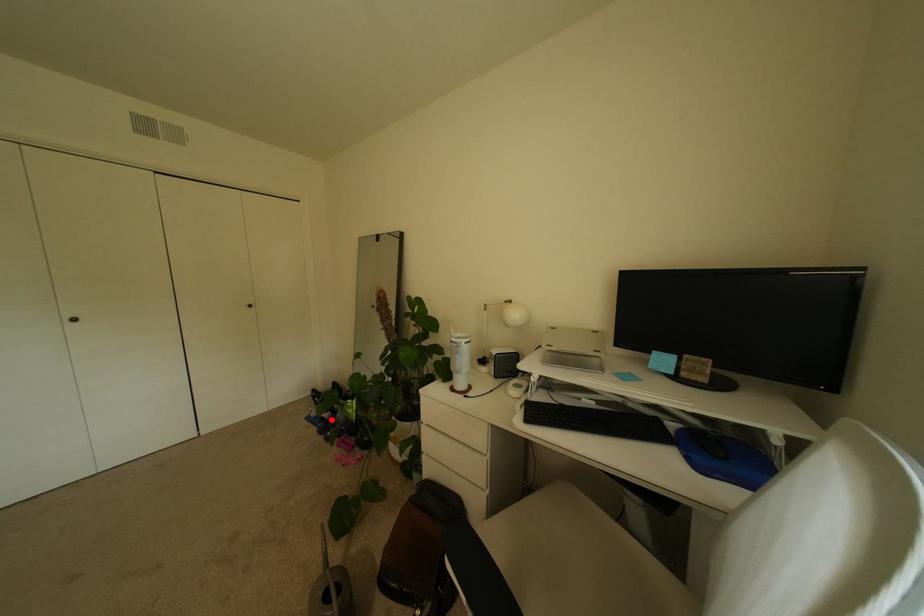
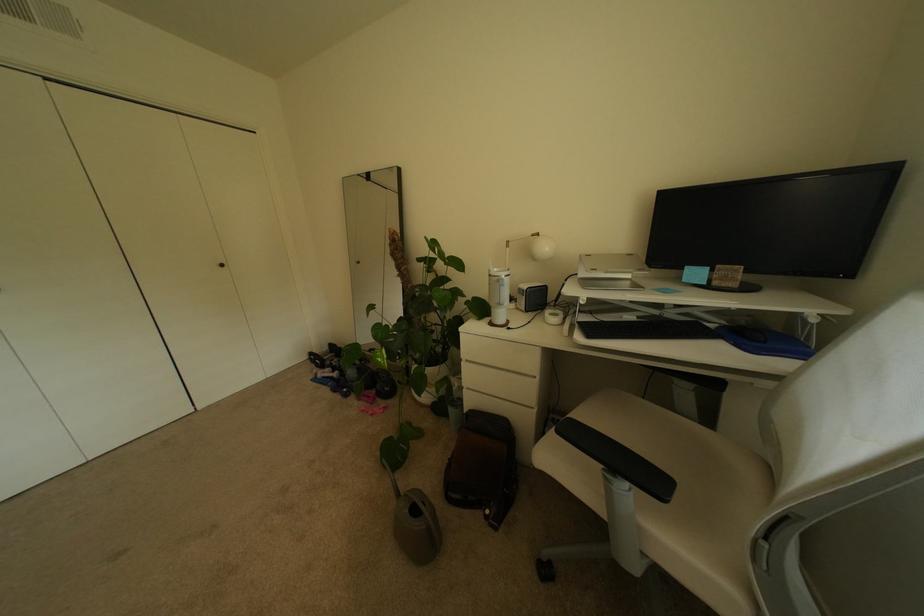
The point at the highlighted location is marked in the first image. Where is the corresponding point in the second image?

(341, 379)